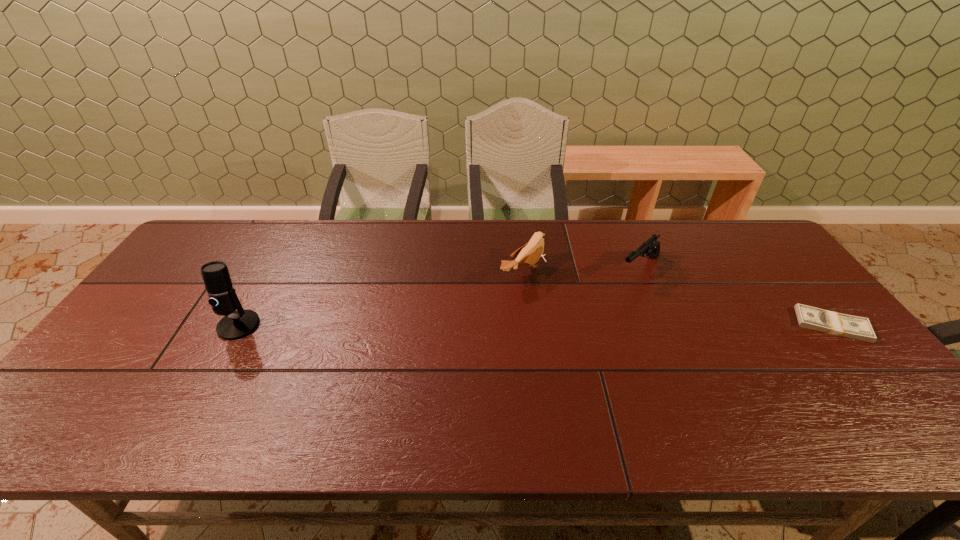
This screenshot has height=540, width=960. Identify the location of vacant spot on the desktop that is between the microphone and the dollar and is positioned at the end of the barrel of the gun. (570, 325).

You are a GUI agent. You are given a task and a screenshot of the screen. Output one action in this format:
    pyautogui.click(x=<x>, y=<y>)
    Task: Click on the vacant spot on the desktop that is between the tallest object and the shortest object and is positioned at the beak of the bird
    
    Given the screenshot: What is the action you would take?
    [x=621, y=325]